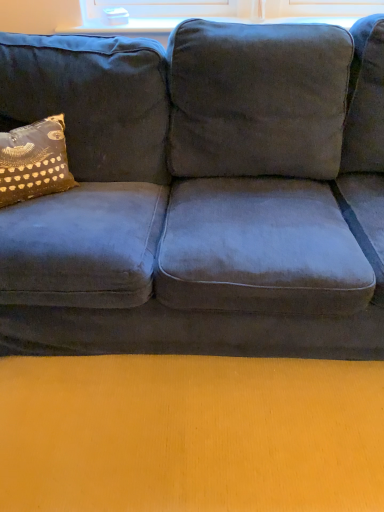
Question: Is gold-patterned fabric pillow at left surrounded by glassy white window sill at upper center?

Choices:
 (A) yes
 (B) no

Answer: (B)

Question: From a real-world perspective, is glassy white window sill at upper center over gold-patterned fabric pillow at left?

Choices:
 (A) no
 (B) yes

Answer: (B)

Question: Is glassy white window sill at upper center aimed at gold-patterned fabric pillow at left?

Choices:
 (A) no
 (B) yes

Answer: (A)

Question: From the image's perspective, does glassy white window sill at upper center appear lower than gold-patterned fabric pillow at left?

Choices:
 (A) yes
 (B) no

Answer: (B)

Question: From a real-world perspective, is glassy white window sill at upper center under gold-patterned fabric pillow at left?

Choices:
 (A) no
 (B) yes

Answer: (A)

Question: Is glassy white window sill at upper center facing away from gold-patterned fabric pillow at left?

Choices:
 (A) no
 (B) yes

Answer: (A)

Question: Considering the relative sizes of gold-patterned fabric pillow at left and glassy white window sill at upper center in the image provided, is gold-patterned fabric pillow at left thinner than glassy white window sill at upper center?

Choices:
 (A) yes
 (B) no

Answer: (B)

Question: Is gold-patterned fabric pillow at left completely or partially outside of glassy white window sill at upper center?

Choices:
 (A) yes
 (B) no

Answer: (A)

Question: Would you say glassy white window sill at upper center is part of gold-patterned fabric pillow at left's contents?

Choices:
 (A) no
 (B) yes

Answer: (A)

Question: Considering the relative positions of gold-patterned fabric pillow at left and glassy white window sill at upper center in the image provided, is gold-patterned fabric pillow at left behind glassy white window sill at upper center?

Choices:
 (A) no
 (B) yes

Answer: (A)

Question: Considering the relative sizes of gold-patterned fabric pillow at left and glassy white window sill at upper center in the image provided, is gold-patterned fabric pillow at left wider than glassy white window sill at upper center?

Choices:
 (A) yes
 (B) no

Answer: (A)

Question: Can you confirm if gold-patterned fabric pillow at left is positioned to the left of glassy white window sill at upper center?

Choices:
 (A) yes
 (B) no

Answer: (A)

Question: Considering the relative positions of glassy white window sill at upper center and gold-patterned fabric pillow at left in the image provided, is glassy white window sill at upper center to the left or to the right of gold-patterned fabric pillow at left?

Choices:
 (A) right
 (B) left

Answer: (A)